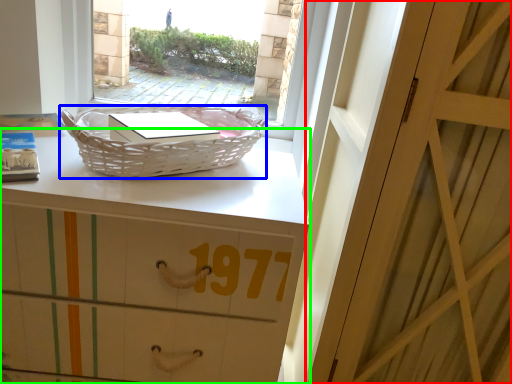
Question: Which object is the farthest from door (highlighted by a red box)? Choose among these: picnic basket (highlighted by a blue box) or desk (highlighted by a green box).

Choices:
 (A) picnic basket
 (B) desk

Answer: (A)